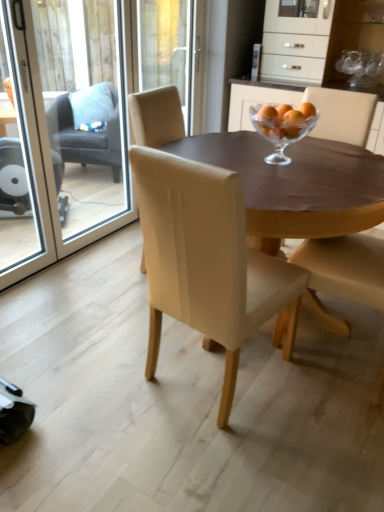
At what (x,y) coordinates should I click in order to perform the action: click on vacant space situated on the left part of clear glass bowl at center. Please return your answer as a coordinate pair (x, y). This screenshot has height=512, width=384. Looking at the image, I should click on (229, 154).